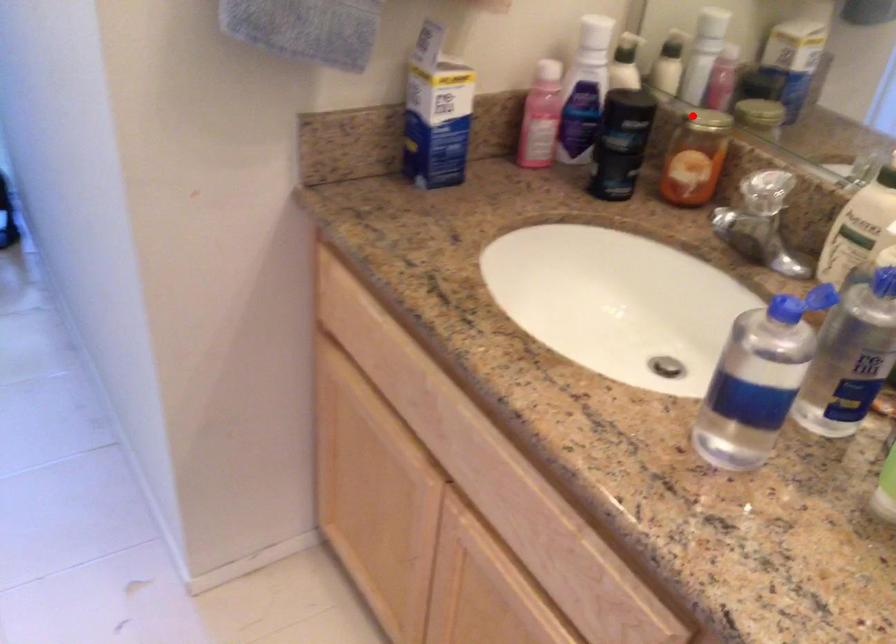
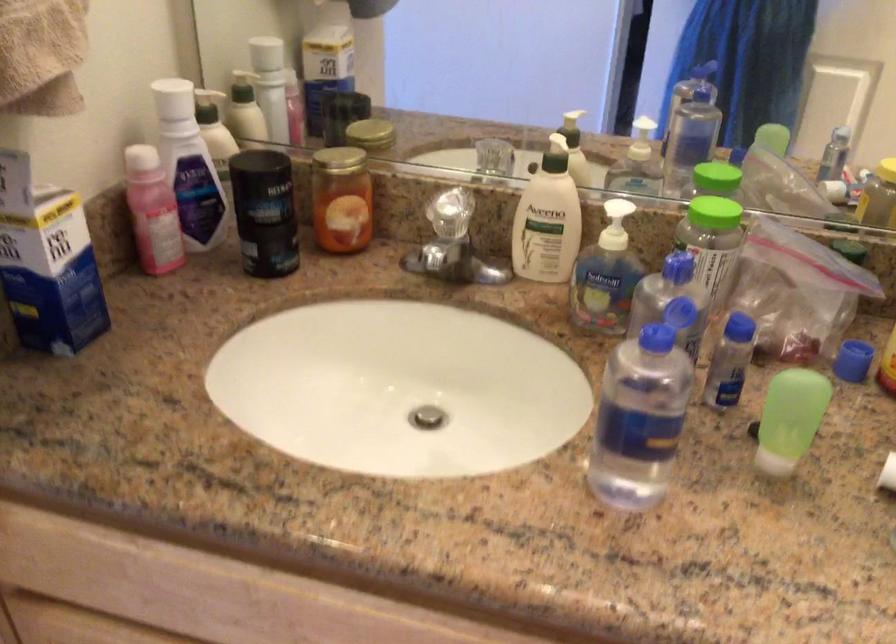
Locate, in the second image, the point that corresponds to the highlighted location in the first image.

(336, 160)